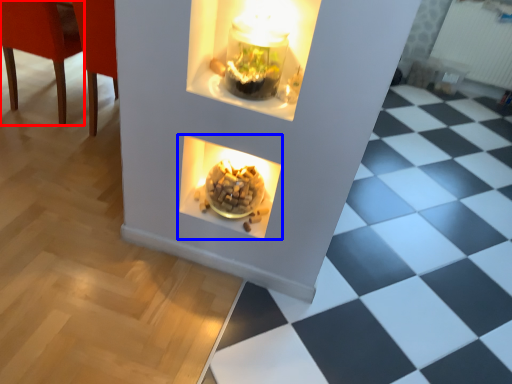
Question: Which point is further to the camera, chair (highlighted by a red box) or fireplace (highlighted by a blue box)?

Choices:
 (A) chair
 (B) fireplace

Answer: (A)